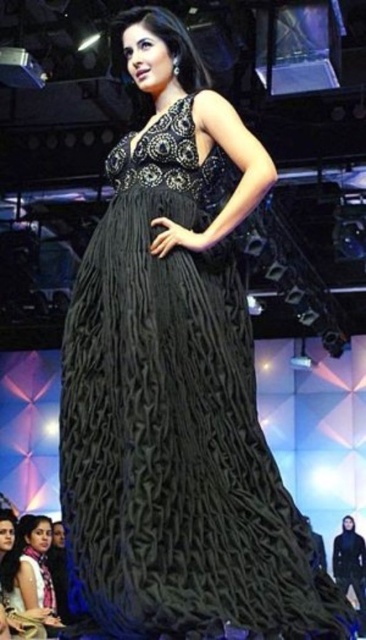
Measure the distance between point (132,618) and camera.

1.98 meters

Which is above, black textured gown at center or matte black dress at center?

black textured gown at center is higher up.

Who is more distant from viewer, (110, 211) or (24, 577)?

Point (24, 577)

Locate an element on the screen. The height and width of the screenshot is (640, 366). black textured gown at center is located at coordinates (173, 426).